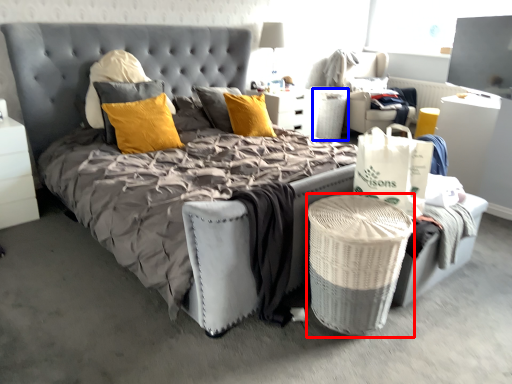
Question: Which point is closer to the camera, laundry basket (highlighted by a red box) or basket (highlighted by a blue box)?

Choices:
 (A) laundry basket
 (B) basket

Answer: (A)